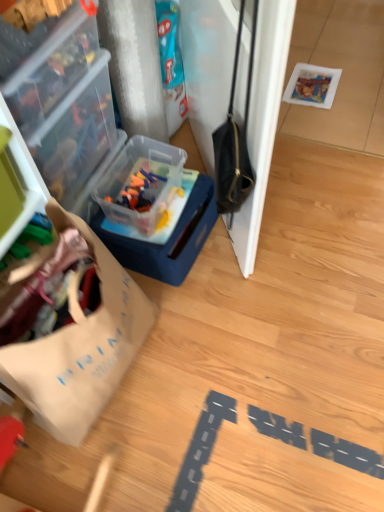
In order to click on vacant area that is in front of translucent plastic container at center-left, which appears as the 1th box when viewed from the right in this screenshot , I will do `click(209, 318)`.